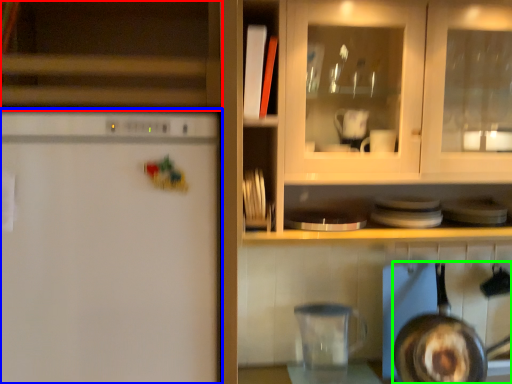
Question: Based on their relative distances, which object is farther from cabinetry (highlighted by a red box)? Choose from refrigerator (highlighted by a blue box) and frying pan (highlighted by a green box).

Choices:
 (A) refrigerator
 (B) frying pan

Answer: (B)